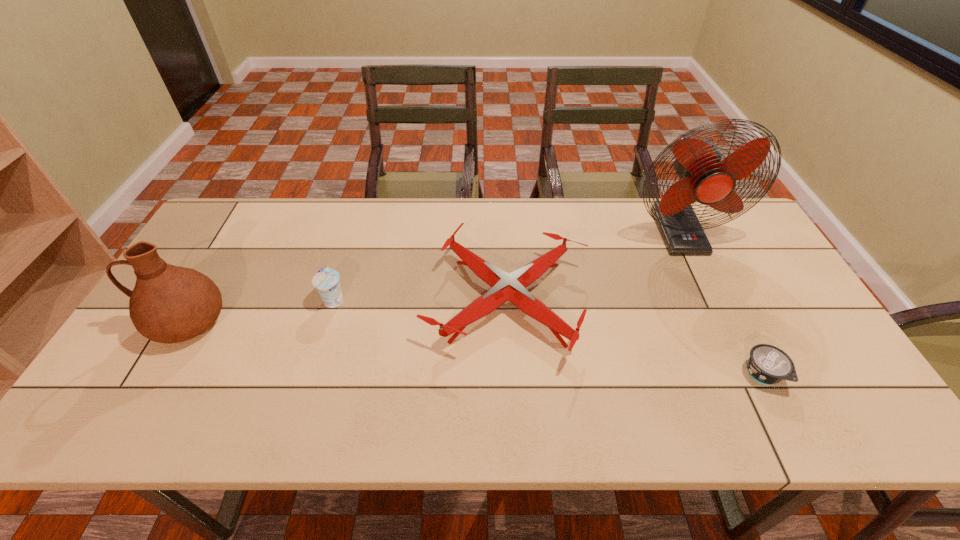
Identify the location of fan. tap(703, 177).

Identify the location of the leftmost object. The width and height of the screenshot is (960, 540). (169, 304).

This screenshot has height=540, width=960. I want to click on pitcher, so click(x=169, y=304).

This screenshot has width=960, height=540. Identify the location of drone. (511, 287).

Image resolution: width=960 pixels, height=540 pixels. I want to click on the taller yogurt, so click(326, 280).

At what (x,y) coordinates should I click in order to perform the action: click on the farther yogurt. Please return your answer as a coordinate pair (x, y). Looking at the image, I should click on (326, 280).

Identify the location of the right yogurt. The height and width of the screenshot is (540, 960). (767, 364).

Locate an element on the screen. the shorter yogurt is located at coordinates 767,364.

You are a GUI agent. You are given a task and a screenshot of the screen. Output one action in this format:
    pyautogui.click(x=<x>, y=<y>)
    Task: Click on the free space located on the front-facing side of the fan
    Image resolution: width=960 pixels, height=540 pixels.
    Given the screenshot: What is the action you would take?
    pyautogui.click(x=706, y=288)

Image resolution: width=960 pixels, height=540 pixels. What are the coordinates of `vacant area located on the back of the drone` in the screenshot? It's located at (502, 211).